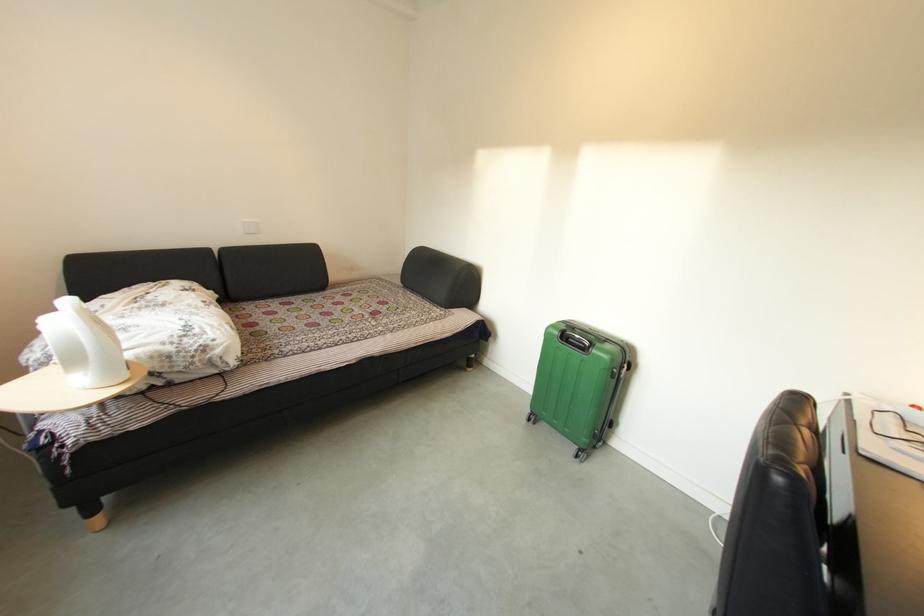
The image size is (924, 616). I want to click on suitcase handle, so click(x=574, y=339).